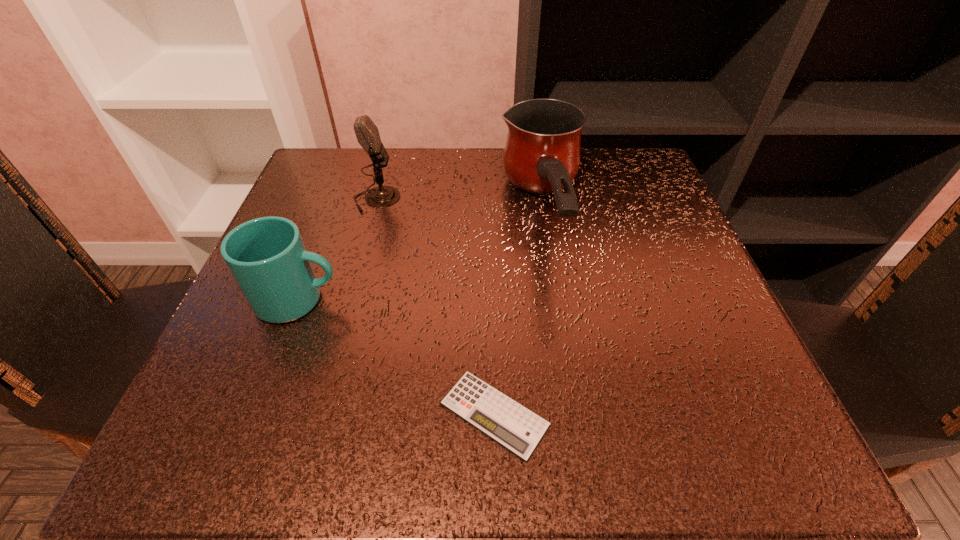
This screenshot has width=960, height=540. Identify the location of microphone. (367, 134).

Find the location of a particular element. This screenshot has height=540, width=960. saucepan is located at coordinates (542, 154).

Where is `the second shortest object`? the second shortest object is located at coordinates point(267,257).

Where is `calculator`? The image size is (960, 540). calculator is located at coordinates (516, 428).

Find the location of a particular element. the shortest object is located at coordinates (x=516, y=428).

The width and height of the screenshot is (960, 540). In order to click on free space located 0.080m on the front-facing side of the microphone in this screenshot , I will do `click(438, 199)`.

Image resolution: width=960 pixels, height=540 pixels. I want to click on free location located 0.130m on the handle side of the saucepan, so click(564, 350).

Identify the location of vacant space situated 0.160m on the handle side of the cup. The width and height of the screenshot is (960, 540). (440, 300).

At what (x,y) coordinates should I click in order to perform the action: click on free space located on the right of the nearest object. Please return your answer as a coordinate pair (x, y). This screenshot has height=540, width=960. Looking at the image, I should click on (708, 414).

In order to click on microphone that is at the far edge in this screenshot , I will do `click(367, 134)`.